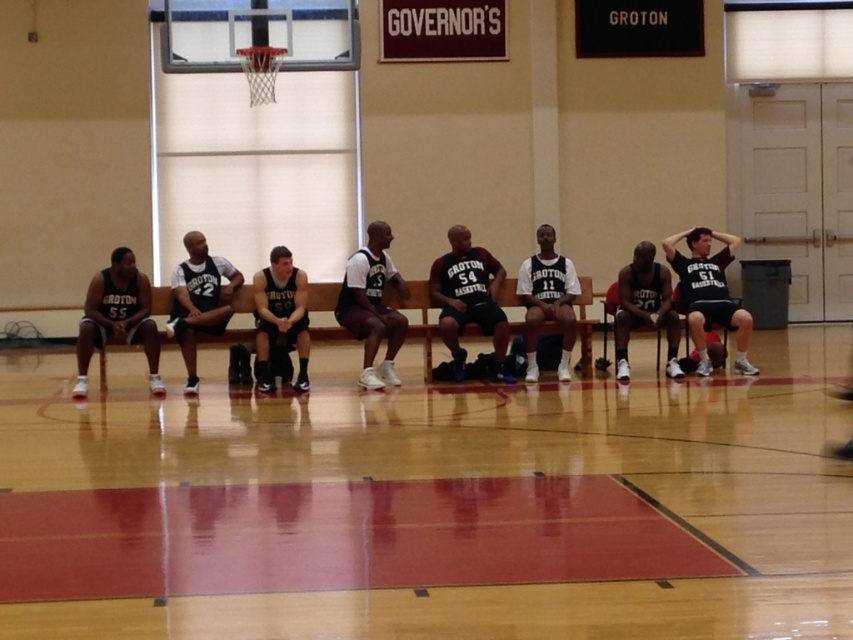
Does point (16, 625) come closer to viewer compared to point (619, 344)?

Yes, point (16, 625) is in front of point (619, 344).

Does point (259, 634) come farther from viewer compared to point (619, 352)?

No, it is in front of (619, 352).

Between point (149, 616) and point (640, 250), which one is positioned in front?

Point (149, 616) is in front.

Locate an element on the screen. The height and width of the screenshot is (640, 853). wooden floor at center is located at coordinates (x=463, y=476).

Is wooden floor at center to the right of dark gray jersey at center from the viewer's perspective?

No, wooden floor at center is not to the right of dark gray jersey at center.

Is wooden floor at center wider than dark gray jersey at center?

Yes, wooden floor at center is wider than dark gray jersey at center.

Which is behind, point (21, 388) or point (489, 301)?

The point (489, 301) is behind.

Where is `wooden floor at center`? wooden floor at center is located at coordinates (463, 476).

Is matte gray jersey at center below matte black shorts at center?

Yes, matte gray jersey at center is below matte black shorts at center.

Who is taller, matte gray jersey at center or matte black shorts at center?

matte gray jersey at center

Who is more distant from viewer, (288, 301) or (643, 273)?

Point (643, 273)

Where is `matte gray jersey at center`? This screenshot has width=853, height=640. matte gray jersey at center is located at coordinates (280, 316).